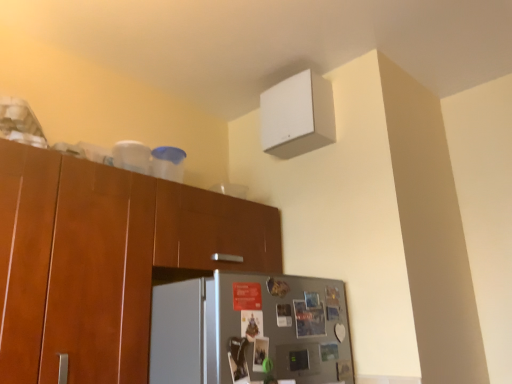
What is the approximate height of metallic gray refrigerator at lower right?

metallic gray refrigerator at lower right is 13.02 inches tall.

Image resolution: width=512 pixels, height=384 pixels. In order to click on metallic gray refrigerator at lower right in this screenshot , I will do `click(249, 329)`.

What do you see at coordinates (249, 329) in the screenshot? I see `metallic gray refrigerator at lower right` at bounding box center [249, 329].

At what (x,y) coordinates should I click in order to perform the action: click on metallic gray refrigerator at lower right. Please return your answer as a coordinate pair (x, y). Looking at the image, I should click on (249, 329).